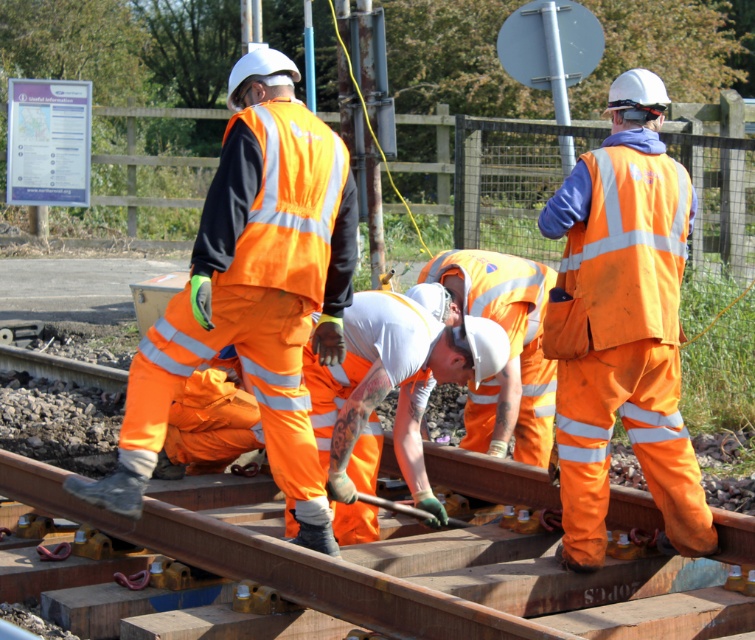
You are a railway inspector checking the maintenance area. There is a point marked at coordinates (626,324). What object is located at that point?

The point at coordinates (626,324) marks the high visibility orange uniform at center.